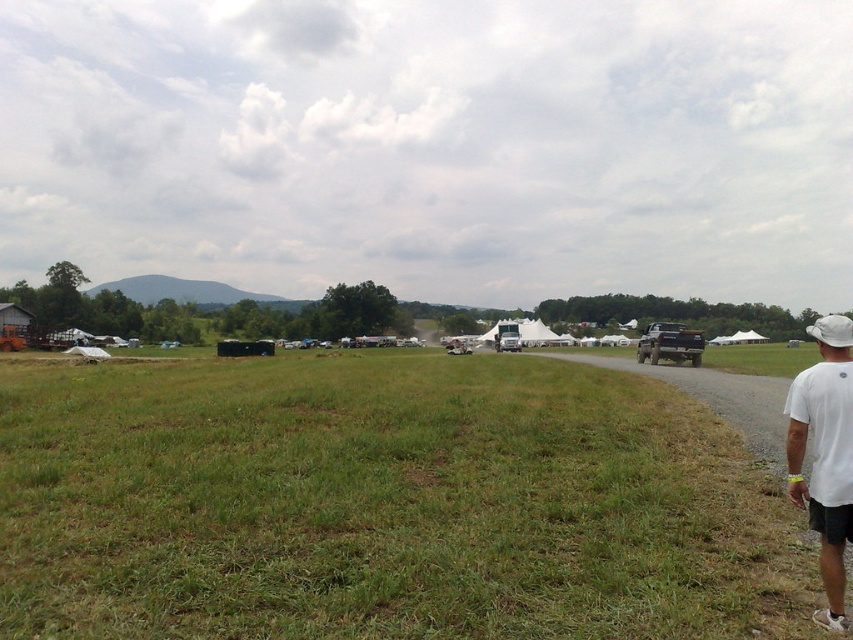
Is white t-shirt at right bigger than matte black truck at right?

Yes.

Is point (798, 413) farther from camera compared to point (654, 346)?

No, (798, 413) is in front of (654, 346).

Is point (830, 536) behind point (653, 336)?

That is False.

The width and height of the screenshot is (853, 640). In order to click on white t-shirt at right in this screenshot , I will do `click(824, 454)`.

Which is above, green grass at center or white fabric baseball hat at right?

white fabric baseball hat at right is above.

From the picture: Is green grass at center to the left of white fabric baseball hat at right from the viewer's perspective?

Correct, you'll find green grass at center to the left of white fabric baseball hat at right.

Is point (630, 483) positioned behind point (845, 317)?

Yes, it is behind point (845, 317).

The image size is (853, 640). I want to click on green grass at center, so click(384, 502).

Is point (335, 477) less distant than point (819, 432)?

No, (335, 477) is further to viewer.

The height and width of the screenshot is (640, 853). What are the coordinates of `green grass at center` in the screenshot? It's located at (384, 502).

Locate an element on the screen. This screenshot has width=853, height=640. green grass at center is located at coordinates (384, 502).